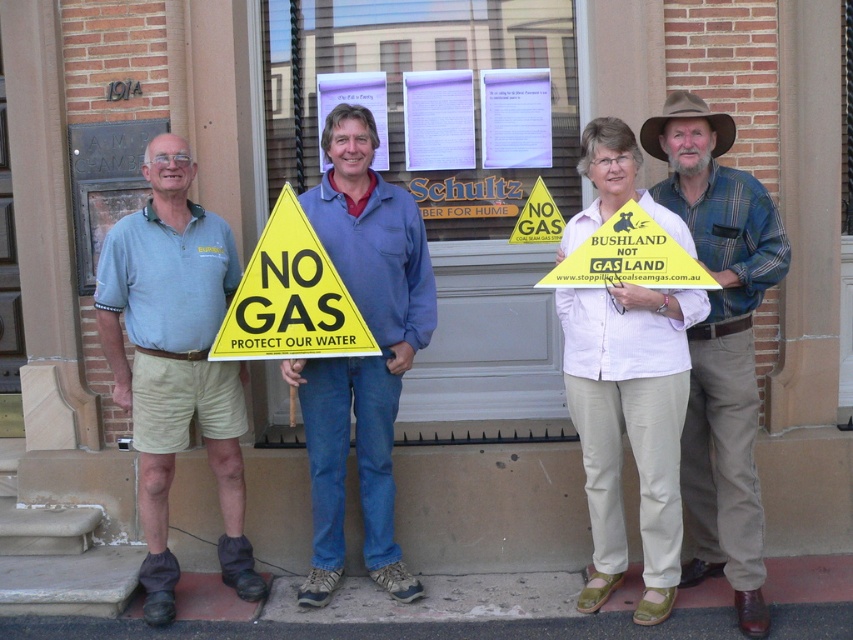
You are standing at the camera position and want to throw a small ball to someone standing near the blue denim jeans at center. Is the distance within a typical throwing range for an adult?

The distance between the blue denim jeans at center and the camera is 15.72 feet, which is within the typical throwing range for an adult, so yes, the ball can be thrown to that distance.

You are a photographer standing in front of the Schultz building. You want to take a photo of the brown plaid shirt at center and the yellow paper sign at center. How far apart are these two items in the image?

The brown plaid shirt at center is 16.29 inches from the yellow paper sign at center.

You are a photographer trying to capture a clear shot of both the brown plaid shirt at center and the yellow paper sign at center. Based on their sizes, which one should you focus on first to ensure it appears larger in your photo?

The brown plaid shirt at center is taller than the yellow paper sign at center, so focusing on the brown plaid shirt at center first will ensure it appears larger in the photo.